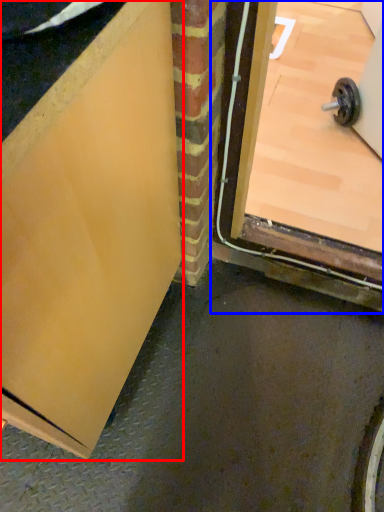
Question: Among these objects, which one is farthest to the camera, door (highlighted by a red box) or door (highlighted by a blue box)?

Choices:
 (A) door
 (B) door

Answer: (B)